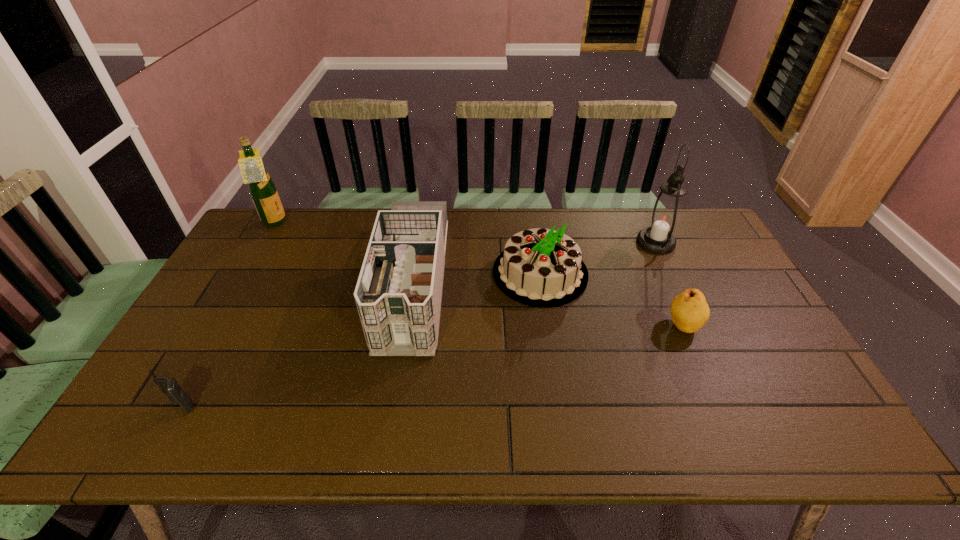
The width and height of the screenshot is (960, 540). In order to click on object that is positioned at the near left corner in this screenshot , I will do `click(169, 386)`.

Locate an element on the screen. object that is at the far right corner is located at coordinates (664, 217).

This screenshot has height=540, width=960. In the image, there is a desktop. In order to click on vacant space at the far edge in this screenshot , I will do `click(297, 244)`.

In the image, there is a desktop. In order to click on vacant space at the near edge in this screenshot , I will do `click(296, 447)`.

In the image, there is a desktop. Where is `vacant space at the left edge`? The image size is (960, 540). vacant space at the left edge is located at coordinates (219, 300).

Identify the location of vacant region at the right edge of the desktop. The width and height of the screenshot is (960, 540). (731, 329).

I want to click on vacant area between the oil lamp and the pear, so click(x=669, y=284).

Where is `free space between the dollhouse and the nearest object`? free space between the dollhouse and the nearest object is located at coordinates (298, 345).

Identify the location of empty space between the nearest object and the birthday cake. This screenshot has height=540, width=960. (362, 340).

At what (x,y) coordinates should I click in order to perform the action: click on free space between the pear and the fourth object from left to right. Please return your answer as a coordinate pair (x, y). Looking at the image, I should click on (612, 299).